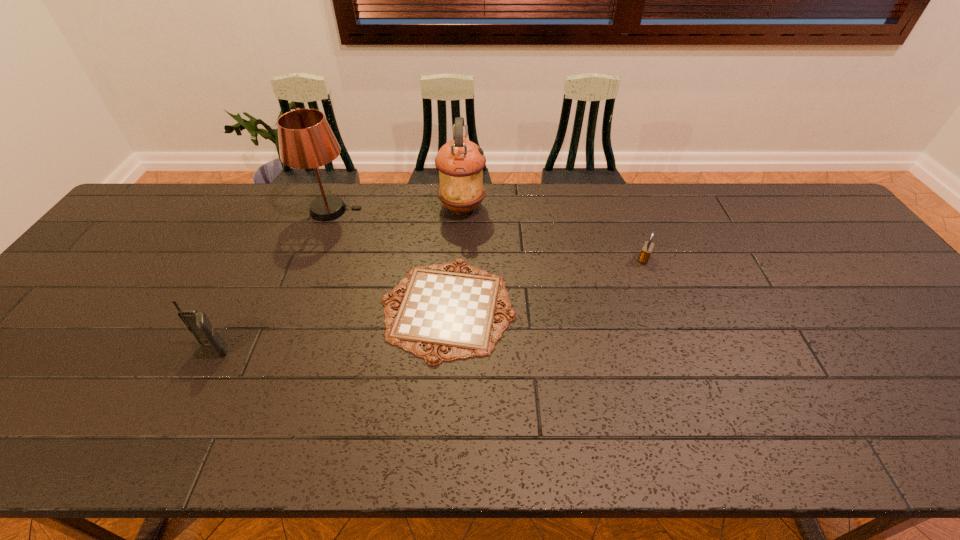
The image size is (960, 540). Identify the location of the second object from left to right. (306, 140).

This screenshot has height=540, width=960. Identify the location of oil lamp. (460, 162).

Image resolution: width=960 pixels, height=540 pixels. What are the coordinates of `the leftmost object` in the screenshot? It's located at (198, 323).

The image size is (960, 540). What are the coordinates of `the third shortest object` in the screenshot? It's located at (198, 323).

Where is `the rightmost object`? the rightmost object is located at coordinates pyautogui.click(x=646, y=251).

Image resolution: width=960 pixels, height=540 pixels. What are the coordinates of `padlock` in the screenshot? It's located at (646, 251).

I want to click on chessboard, so click(x=441, y=310).

What are the coordinates of `free region located 0.200m on the front-facing side of the lampshade` in the screenshot? It's located at [x=423, y=211].

The height and width of the screenshot is (540, 960). Find the location of `vacant space located 0.140m on the left of the oil lamp`. vacant space located 0.140m on the left of the oil lamp is located at coordinates (396, 208).

The width and height of the screenshot is (960, 540). What are the coordinates of `free spot located on the keyboard of the leftmost object` in the screenshot? It's located at (162, 453).